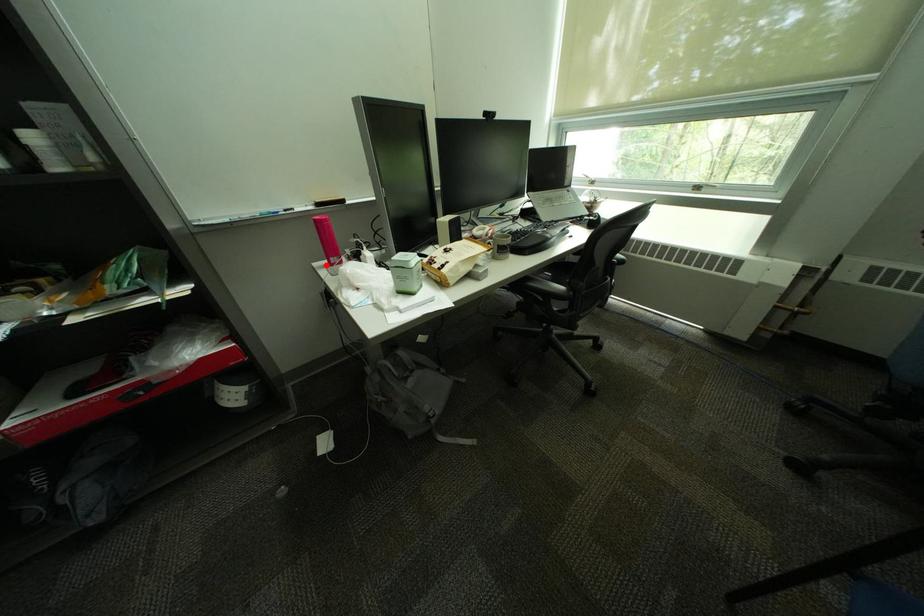
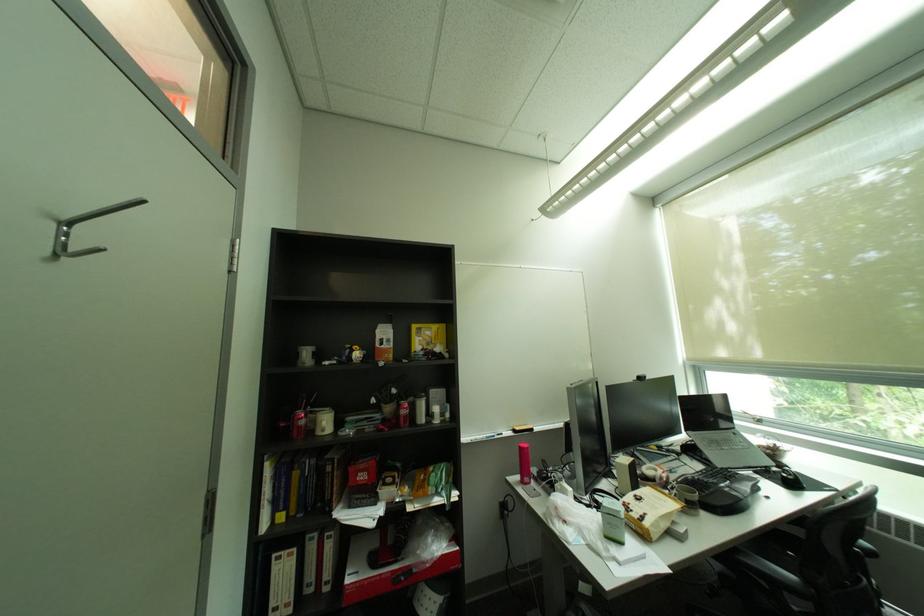
Find the pixel in the second image that matches the highlighted location in the first image.

(520, 480)